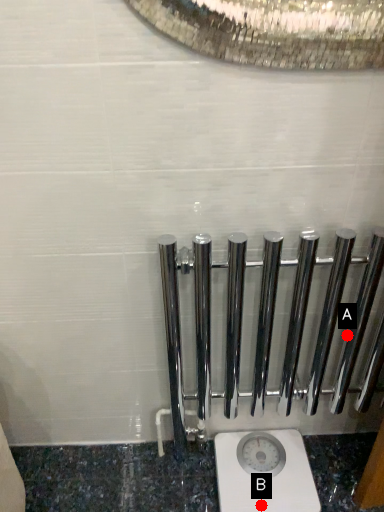
Question: Two points are circled on the image, labeled by A and B beside each circle. Which point appears farthest from the camera in this image?

Choices:
 (A) A is further
 (B) B is further

Answer: (B)